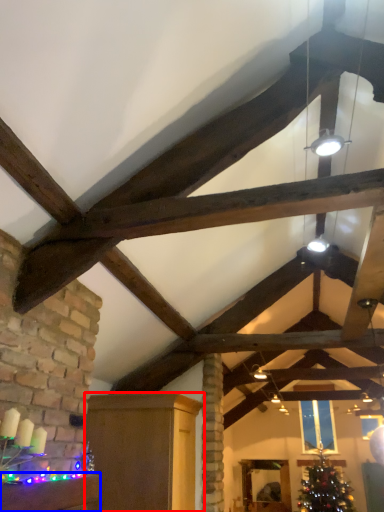
Question: Which point is further to the camera, furniture (highlighted by a red box) or furniture (highlighted by a blue box)?

Choices:
 (A) furniture
 (B) furniture

Answer: (A)